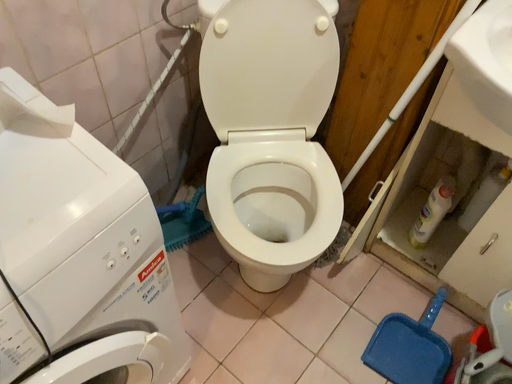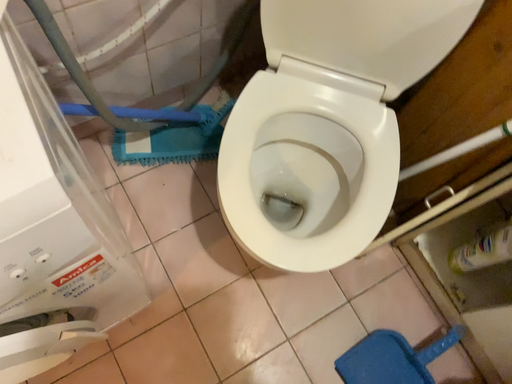
Question: Which way did the camera rotate in the video?

Choices:
 (A) rotated right
 (B) rotated left

Answer: (B)